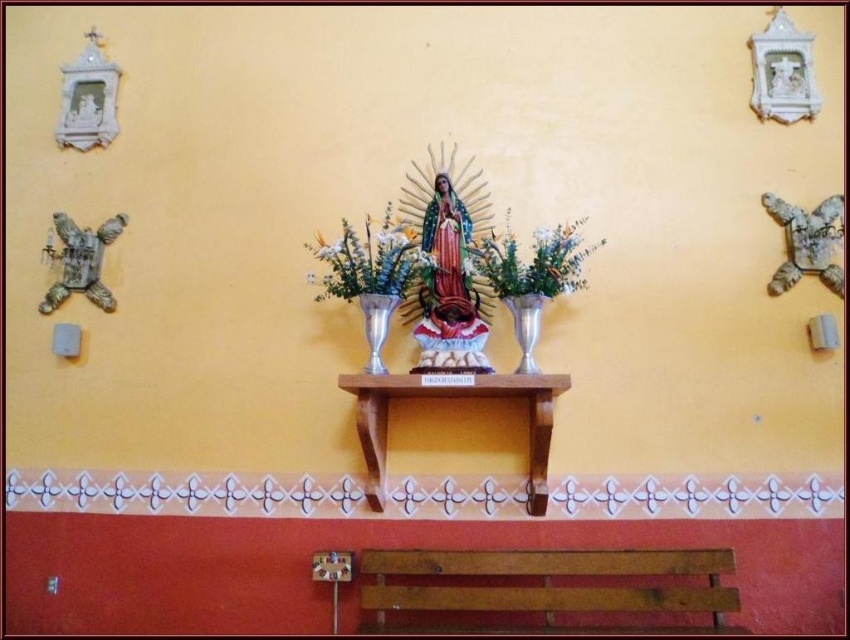
Looking at this image, does matte silver vase at center appear over silver metallic vase at center?

Yes, matte silver vase at center is above silver metallic vase at center.

Between matte silver vase at center and silver metallic vase at center, which one has more height?

Standing taller between the two is matte silver vase at center.

Is point (350, 285) positioned before point (516, 314)?

No, (350, 285) is behind (516, 314).

Identify the location of matte silver vase at center. The width and height of the screenshot is (850, 640). (x=367, y=259).

From the picture: Is matte silver vase at center below green leafy plant at center?

Correct, matte silver vase at center is located below green leafy plant at center.

Between matte silver vase at center and green leafy plant at center, which one has less height?

green leafy plant at center is shorter.

Does point (411, 257) lie in front of point (469, 250)?

Yes.

Where is `matte silver vase at center`? Image resolution: width=850 pixels, height=640 pixels. matte silver vase at center is located at coordinates (367, 259).

Which is below, wooden shelf at center or silver metallic vase at center?

Positioned lower is wooden shelf at center.

Can you confirm if wooden shelf at center is smaller than silver metallic vase at center?

No.

Which is in front, point (531, 436) or point (527, 316)?

Positioned in front is point (527, 316).

Where is `wooden shelf at center`? The height and width of the screenshot is (640, 850). wooden shelf at center is located at coordinates (452, 397).